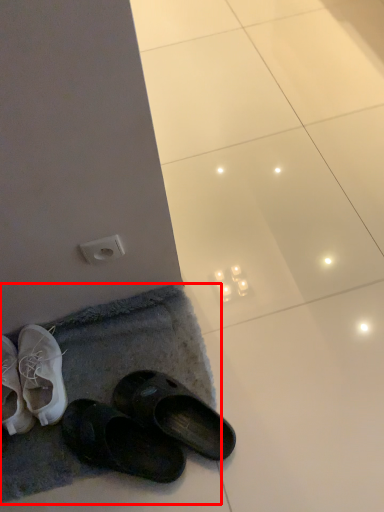
Question: Observing the image, what is the correct spatial positioning of bath mat (annotated by the red box) in reference to electric outlet?

Choices:
 (A) right
 (B) left

Answer: (B)